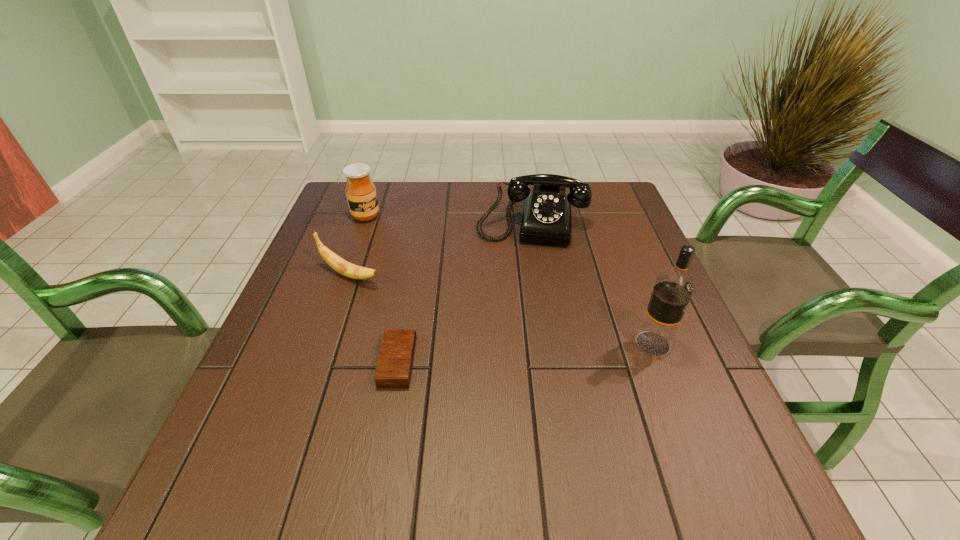
Identify the location of free space between the third object from right to left and the third nearest object. (373, 319).

The height and width of the screenshot is (540, 960). What are the coordinates of `free area in between the telephone and the alarm clock` in the screenshot? It's located at (465, 291).

Select which object appears as the closest to the honey. Please provide its 2D coordinates. Your answer should be formatted as a tuple, i.e. [(x, y)], where the tuple contains the x and y coordinates of a point satisfying the conditions above.

[(350, 270)]

Locate an element on the screen. Image resolution: width=960 pixels, height=540 pixels. object that stands as the third closest to the vodka is located at coordinates (350, 270).

You are a GUI agent. You are given a task and a screenshot of the screen. Output one action in this format:
    pyautogui.click(x=<x>, y=<y>)
    Task: Click on the free region that satisfies the following two spatial constraints: 1. on the front side of the tallest object; 2. on the label of the second shortest object
    
    Given the screenshot: What is the action you would take?
    pyautogui.click(x=326, y=343)

The width and height of the screenshot is (960, 540). What are the coordinates of `vacant space that satisfies the following two spatial constraints: 1. on the front side of the honey; 2. on the right side of the third farthest object` in the screenshot? It's located at tap(345, 275).